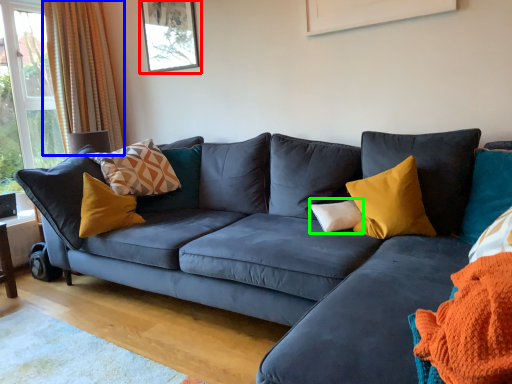
Question: Based on their relative distances, which object is farther from picture frame (highlighted by a red box)? Choose from curtain (highlighted by a blue box) and pillow (highlighted by a green box).

Choices:
 (A) curtain
 (B) pillow

Answer: (B)